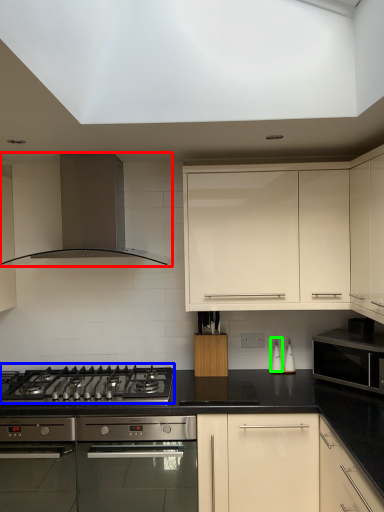
Question: Which is nearer to the kitchen appliance (highlighted by a red box)? gas stove (highlighted by a blue box) or appliance (highlighted by a green box).

Choices:
 (A) gas stove
 (B) appliance

Answer: (A)